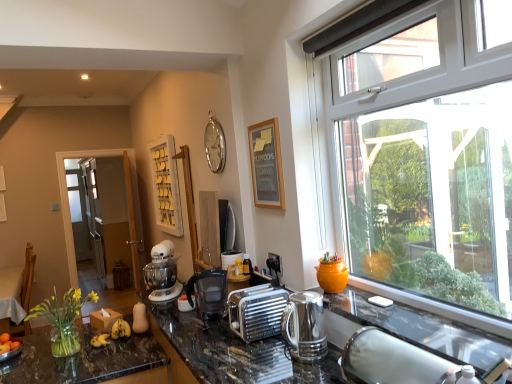
This screenshot has width=512, height=384. In order to click on black plastic coffee machine at center, which is the first coffee machine from back to front in this screenshot , I will do `click(208, 293)`.

What do you see at coordinates (426, 161) in the screenshot? The image size is (512, 384). I see `white plastic window at right` at bounding box center [426, 161].

At what (x,y) coordinates should I click in order to perform the action: click on silver metallic clock at upper center. Please return your answer as a coordinate pair (x, y). The height and width of the screenshot is (384, 512). Looking at the image, I should click on (215, 145).

What do you see at coordinates (215, 145) in the screenshot? I see `silver metallic clock at upper center` at bounding box center [215, 145].

The height and width of the screenshot is (384, 512). I want to click on white wooden shelf at upper center, so click(x=166, y=185).

Identify the location of black plastic coffee machine at center, which appears as the 1th coffee machine when viewed from the left. The image size is (512, 384). (208, 293).

Which appliance is the 1st one when counting from the front of the white metallic mixer at center? Please provide its 2D coordinates.

[(230, 258)]

Considering the positions of objects metallic silver toaster at center, which ranks as the 1th appliance in back-to-front order, and white metallic mixer at center in the image provided, who is more to the left, metallic silver toaster at center, which ranks as the 1th appliance in back-to-front order, or white metallic mixer at center?

Positioned to the left is white metallic mixer at center.

Considering the sizes of objects metallic silver toaster at center, the second appliance when ordered from front to back, and white metallic mixer at center in the image provided, who is smaller, metallic silver toaster at center, the second appliance when ordered from front to back, or white metallic mixer at center?

With smaller size is metallic silver toaster at center, the second appliance when ordered from front to back.

Is wooden chair at left taller than white wooden shelf at upper center?

In fact, wooden chair at left may be shorter than white wooden shelf at upper center.

From the image's perspective, between wooden chair at left and white wooden shelf at upper center, who is located below?

wooden chair at left.

Relative to white wooden shelf at upper center, is wooden chair at left in front or behind?

In the image, wooden chair at left appears behind white wooden shelf at upper center.

Find the location of `shelf above the wooden chair at left (from the image's perspective)`. shelf above the wooden chair at left (from the image's perspective) is located at coordinates (166, 185).

Is point (255, 201) closer to camera compared to point (221, 260)?

Yes, point (255, 201) is closer to viewer.

Is metallic silver toaster at center, the second appliance when ordered from front to back, located within wooden picture frame at upper center?

Actually, metallic silver toaster at center, the second appliance when ordered from front to back, is outside wooden picture frame at upper center.

Does wooden picture frame at upper center turn towards metallic silver toaster at center, the second appliance when ordered from front to back?

No, wooden picture frame at upper center is not facing towards metallic silver toaster at center, the second appliance when ordered from front to back.

Does point (10, 329) lie behind point (259, 181)?

Yes.

From a real-world perspective, does wooden chair at left stand above wooden picture frame at upper center?

No, from a real-world perspective, wooden chair at left is not over wooden picture frame at upper center

Consider the image. Is wooden chair at left located outside wooden picture frame at upper center?

Yes, wooden chair at left is not within wooden picture frame at upper center.

From the image's perspective, which one is positioned lower, black plastic coffee machine at center, which appears as the 1th coffee machine when viewed from the left, or silver metallic clock at upper center?

Answer: black plastic coffee machine at center, which appears as the 1th coffee machine when viewed from the left, is shown below in the image.

From the picture: Is black plastic coffee machine at center, placed as the second coffee machine when sorted from right to left, facing away from silver metallic clock at upper center?

That's not correct — black plastic coffee machine at center, placed as the second coffee machine when sorted from right to left, is not looking away from silver metallic clock at upper center.

There is a silver metallic clock at upper center. Where is `the 1st coffee machine below it (from a real-world perspective)`? the 1st coffee machine below it (from a real-world perspective) is located at coordinates (208, 293).

Does black plastic coffee machine at center, the 2th coffee machine when ordered from front to back, have a lesser width compared to silver metallic clock at upper center?

Incorrect, the width of black plastic coffee machine at center, the 2th coffee machine when ordered from front to back, is not less than that of silver metallic clock at upper center.

Consider the image. Is translucent glass countertop at lower left at the right side of wooden picture frame at upper center?

No, translucent glass countertop at lower left is not to the right of wooden picture frame at upper center.

Could you tell me if translucent glass countertop at lower left is facing wooden picture frame at upper center?

No, translucent glass countertop at lower left is not oriented towards wooden picture frame at upper center.

Are translucent glass countertop at lower left and wooden picture frame at upper center far apart?

Yes, translucent glass countertop at lower left is far from wooden picture frame at upper center.

In the image, there is a wooden picture frame at upper center. Where is `countertop below it (from the image's perspective)`? countertop below it (from the image's perspective) is located at coordinates (82, 360).

From a real-world perspective, between translucent glass countertop at lower left and polished granite countertop at center, who is vertically lower?

polished granite countertop at center.

Would you say translucent glass countertop at lower left contains polished granite countertop at center?

No, polished granite countertop at center is not a part of translucent glass countertop at lower left.

You are a GUI agent. You are given a task and a screenshot of the screen. Output one action in this format:
    pyautogui.click(x=<x>, y=<y>)
    Task: Click on the counter top on the right of the translucent glass countertop at lower left
    The image size is (512, 384).
    Given the screenshot: What is the action you would take?
    pyautogui.click(x=236, y=352)

Find the location of a particular element. The image size is (512, 384). the 1st appliance in front of the white metallic mixer at center is located at coordinates (230, 258).

At what (x,y) coordinates should I click in order to perform the action: click on shelf on the right of wooden chair at left. Please return your answer as a coordinate pair (x, y). This screenshot has width=512, height=384. Looking at the image, I should click on (166, 185).

Based on their spatial positions, is translucent glass countertop at lower left or white plastic window at right closer to polished granite countertop at center?

translucent glass countertop at lower left is positioned closer to the anchor polished granite countertop at center.

Based on their spatial positions, is polished granite countertop at center or silver metallic toaster at center, the first appliance positioned from the front, further from polished stainless steel kettle at lower right, which is the 1th coffee machine from front to back?

polished granite countertop at center.

Based on the photo, looking at the image, which one is located closer to wooden chair at left, translucent glass countertop at lower left or polished granite countertop at center?

The object closer to wooden chair at left is translucent glass countertop at lower left.

Considering their positions, is polished stainless steel kettle at lower right, arranged as the second coffee machine when viewed from the left, positioned closer to white glossy screen door at left, which appears as the 1th screen door when viewed from the front, than silver metallic toaster at center, which is the first appliance in bottom-to-top order?

The object closer to white glossy screen door at left, which appears as the 1th screen door when viewed from the front, is silver metallic toaster at center, which is the first appliance in bottom-to-top order.

Looking at the image, which one is located closer to white plastic window at right, polished granite countertop at center or yellow matte bananas at center?

The object closer to white plastic window at right is polished granite countertop at center.

Looking at the image, which one is located closer to white plastic window at right, polished stainless steel kettle at lower right, arranged as the second coffee machine when viewed from the left, or silver metallic toaster at center, the second appliance positioned from the back?

polished stainless steel kettle at lower right, arranged as the second coffee machine when viewed from the left, lies closer to white plastic window at right than the other object.

When comparing their distances from polished stainless steel kettle at lower right, which is the second coffee machine from back to front, does white plastic window at right or black plastic coffee machine at center, placed as the second coffee machine when sorted from right to left, seem further?

white plastic window at right.

Estimate the real-world distances between objects in this image. Which object is closer to polished stainless steel kettle at lower right, which is the 1th coffee machine from front to back, silver metallic clock at upper center or wooden chair at left?

silver metallic clock at upper center lies closer to polished stainless steel kettle at lower right, which is the 1th coffee machine from front to back, than the other object.

Locate an element on the screen. This screenshot has height=384, width=512. mixer between metallic silver toaster at center, the first appliance positioned from the top, and white wooden shelf at upper center from front to back is located at coordinates (162, 273).

Where is `clock between polished granite countertop at center and white wooden shelf at upper center from front to back`? The image size is (512, 384). clock between polished granite countertop at center and white wooden shelf at upper center from front to back is located at coordinates (215, 145).

Where is `appliance positioned between orange matte bowl at lower left and white wooden shelf at upper center from near to far`? The width and height of the screenshot is (512, 384). appliance positioned between orange matte bowl at lower left and white wooden shelf at upper center from near to far is located at coordinates (230, 258).

Identify the location of mixer between white plastic window at right and transparent frosted glass screen door at left, the 1th screen door from the left, from front to back. (162, 273).